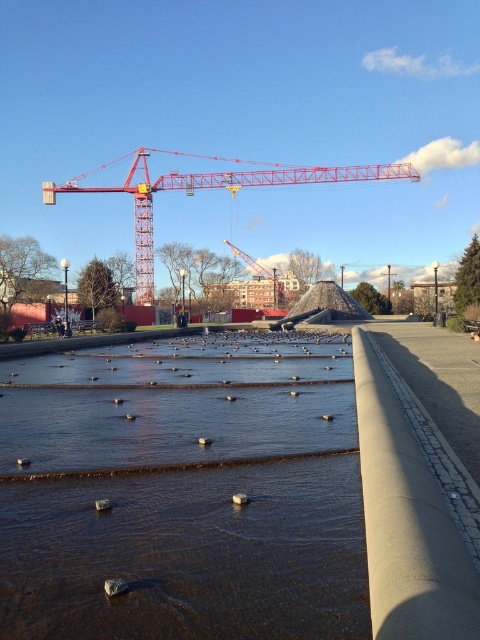
Question: Which object appears farthest from the camera in this image?

Choices:
 (A) red metallic crane at center
 (B) metallic red crane at center
 (C) clear water at center

Answer: (A)

Question: Is clear water at center bigger than red metallic crane at center?

Choices:
 (A) yes
 (B) no

Answer: (B)

Question: Considering the real-world distances, which object is closest to the red metallic crane at center?

Choices:
 (A) clear water at center
 (B) metallic red crane at center

Answer: (B)

Question: Among these objects, which one is farthest from the camera?

Choices:
 (A) clear water at center
 (B) metallic red crane at center
 (C) red metallic crane at center

Answer: (C)

Question: Does metallic red crane at center have a larger size compared to red metallic crane at center?

Choices:
 (A) no
 (B) yes

Answer: (B)

Question: Observing the image, what is the correct spatial positioning of clear water at center in reference to red metallic crane at center?

Choices:
 (A) below
 (B) above

Answer: (A)